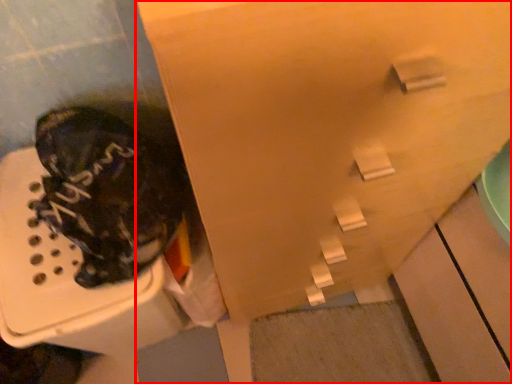
Question: From the image, what is the correct spatial relationship of cabinetry (annotated by the red box) in relation to footwear?

Choices:
 (A) left
 (B) right

Answer: (B)